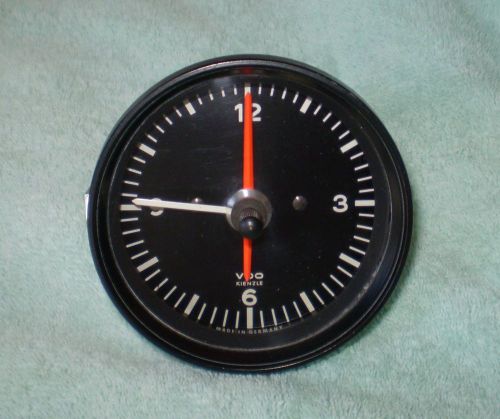
The height and width of the screenshot is (419, 500). I want to click on wall, so click(x=122, y=56).